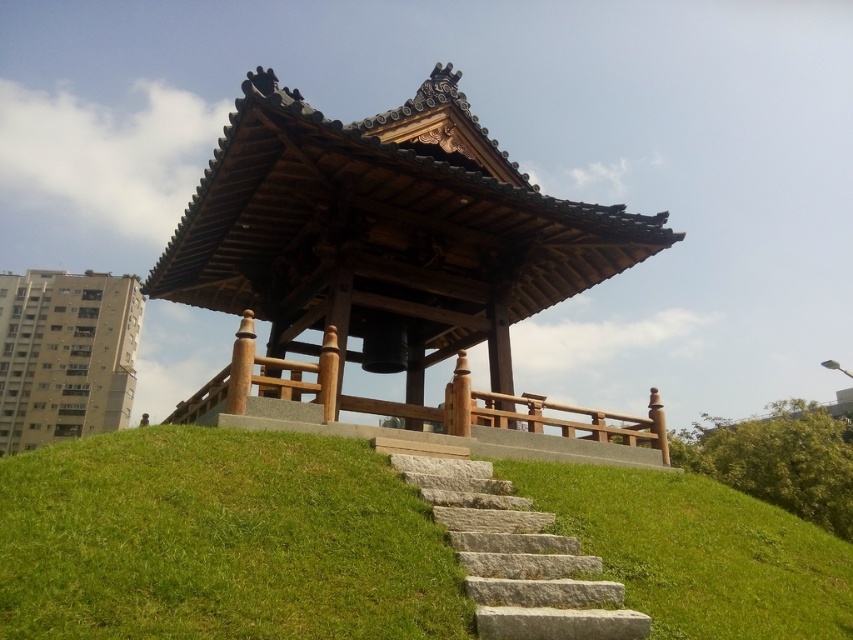
Question: Does green stone stairs at center have a larger size compared to gray stone stairs at center?

Choices:
 (A) no
 (B) yes

Answer: (B)

Question: Which point is closer to the camera taking this photo?

Choices:
 (A) (585, 604)
 (B) (300, 634)

Answer: (B)

Question: Is wooden gazebo at center positioned at the back of green grass at lower center?

Choices:
 (A) no
 (B) yes

Answer: (B)

Question: Can you confirm if wooden gazebo at center is thinner than green grass at lower center?

Choices:
 (A) yes
 (B) no

Answer: (B)

Question: Estimate the real-world distances between objects in this image. Which object is farther from the gray stone stairs at center?

Choices:
 (A) green stone stairs at center
 (B) green grass at lower center
 (C) wooden gazebo at center

Answer: (C)

Question: Estimate the real-world distances between objects in this image. Which object is farther from the gray stone stairs at center?

Choices:
 (A) green stone stairs at center
 (B) green grass at lower center

Answer: (A)